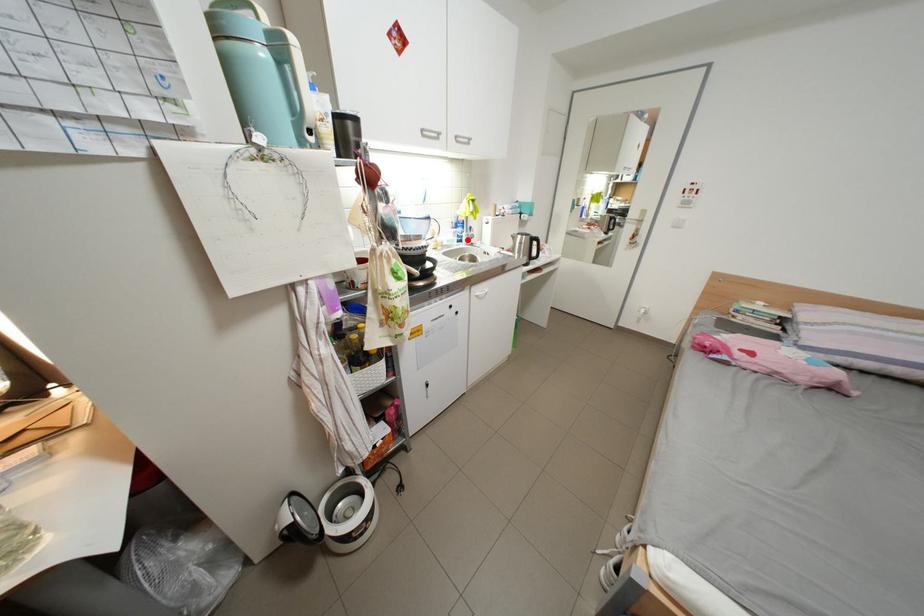
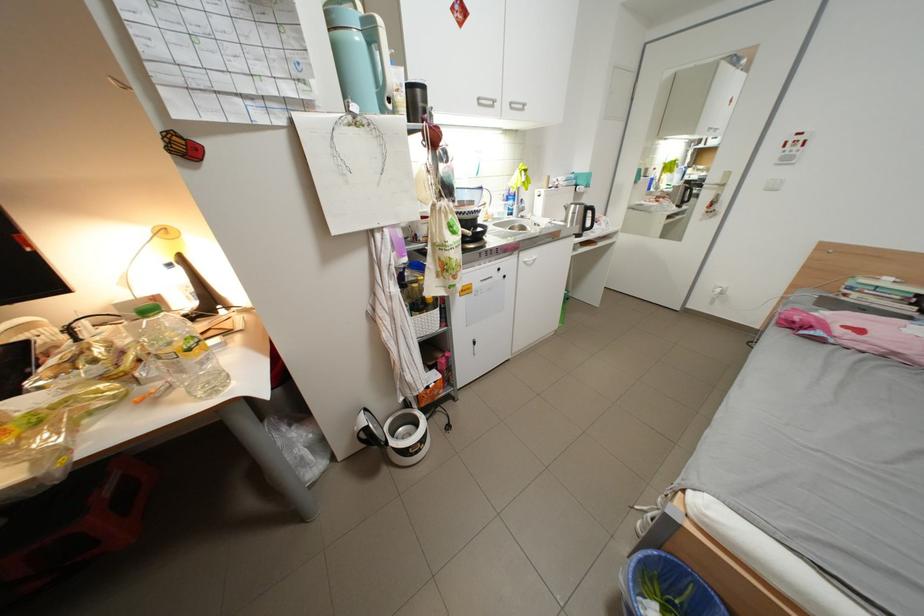
Find the pixel in the second image that matches the highlighted location in the first image.

(517, 213)